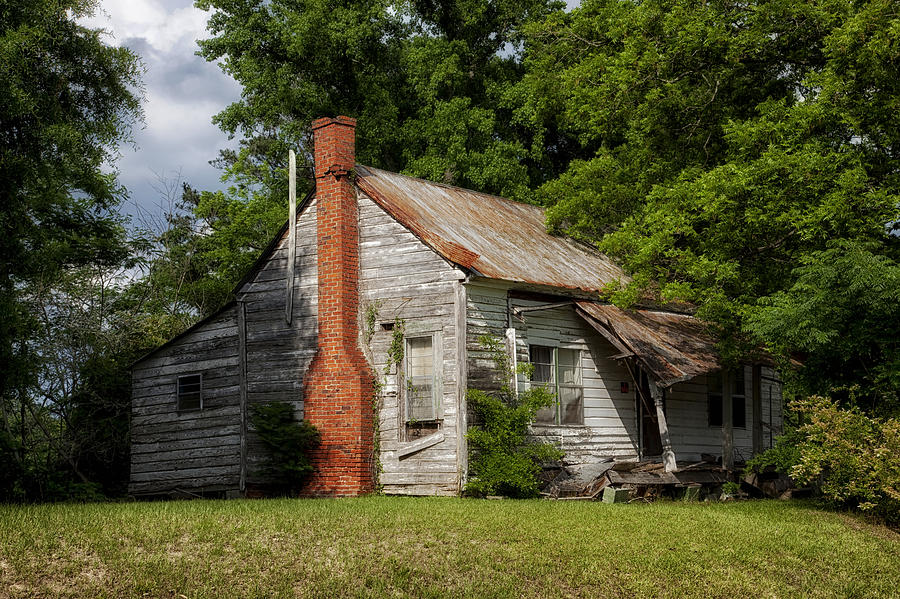
Where is `chimney`? The width and height of the screenshot is (900, 599). chimney is located at coordinates (343, 287).